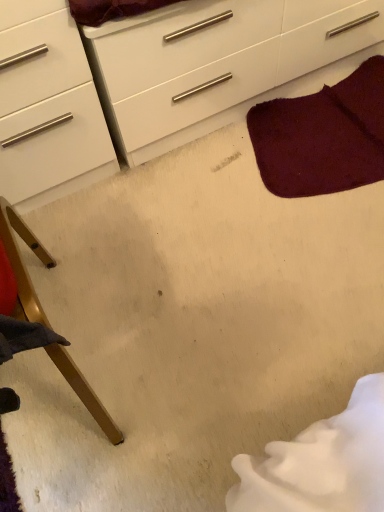
Question: Considering the relative sizes of white glossy chest of drawers at upper center and burgundy plush rug at upper right in the image provided, is white glossy chest of drawers at upper center bigger than burgundy plush rug at upper right?

Choices:
 (A) yes
 (B) no

Answer: (A)

Question: Does white glossy chest of drawers at upper center have a lesser width compared to burgundy plush rug at upper right?

Choices:
 (A) yes
 (B) no

Answer: (B)

Question: Is white glossy chest of drawers at upper center in front of burgundy plush rug at upper right?

Choices:
 (A) no
 (B) yes

Answer: (B)

Question: Considering the relative sizes of white glossy chest of drawers at upper center and burgundy plush rug at upper right in the image provided, is white glossy chest of drawers at upper center taller than burgundy plush rug at upper right?

Choices:
 (A) yes
 (B) no

Answer: (A)

Question: Does white glossy chest of drawers at upper center come behind burgundy plush rug at upper right?

Choices:
 (A) yes
 (B) no

Answer: (B)

Question: From the image's perspective, is white glossy chest of drawers at upper center beneath burgundy plush rug at upper right?

Choices:
 (A) no
 (B) yes

Answer: (A)

Question: Is burgundy plush rug at upper right closer to the viewer compared to wooden chair leg at lower left?

Choices:
 (A) no
 (B) yes

Answer: (A)

Question: Is burgundy plush rug at upper right facing away from wooden chair leg at lower left?

Choices:
 (A) yes
 (B) no

Answer: (B)

Question: From the image's perspective, is burgundy plush rug at upper right on wooden chair leg at lower left?

Choices:
 (A) no
 (B) yes

Answer: (B)

Question: From a real-world perspective, is burgundy plush rug at upper right physically above wooden chair leg at lower left?

Choices:
 (A) yes
 (B) no

Answer: (B)

Question: From the image's perspective, is burgundy plush rug at upper right under wooden chair leg at lower left?

Choices:
 (A) yes
 (B) no

Answer: (B)

Question: Does burgundy plush rug at upper right appear on the right side of wooden chair leg at lower left?

Choices:
 (A) yes
 (B) no

Answer: (A)

Question: Is white glossy chest of drawers at upper center at the back of wooden chair leg at lower left?

Choices:
 (A) yes
 (B) no

Answer: (B)